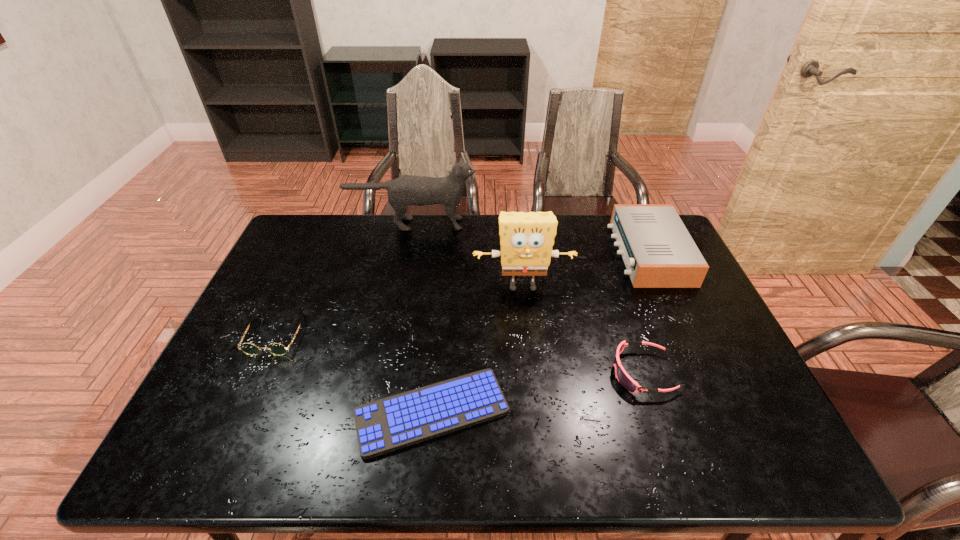
Locate an element on the screen. vacant space situated 0.370m on the control panel of the radio receiver is located at coordinates (503, 253).

At what (x,y) coordinates should I click in order to perform the action: click on vacant region located on the front-facing side of the goggles. Please return your answer as a coordinate pair (x, y). Looking at the image, I should click on (572, 373).

Identify the location of free space located 0.330m on the front-facing side of the goggles. (480, 373).

Locate an element on the screen. This screenshot has width=960, height=540. free space located on the front-facing side of the goggles is located at coordinates pyautogui.click(x=484, y=373).

This screenshot has width=960, height=540. I want to click on vacant space situated on the lenses of the leftmost object, so click(229, 437).

You are a GUI agent. You are given a task and a screenshot of the screen. Output one action in this format:
    pyautogui.click(x=<x>, y=<y>)
    Task: Click on the vacant space located 0.210m on the right of the shortest object
    
    Given the screenshot: What is the action you would take?
    pyautogui.click(x=600, y=412)

This screenshot has height=540, width=960. Find the location of `cat present at the far edge`. cat present at the far edge is located at coordinates (406, 190).

What are the coordinates of `radio receiver that is at the far edge` in the screenshot? It's located at (658, 251).

Identify the location of object positioned at the near edge. (398, 421).

Locate an element on the screen. The width and height of the screenshot is (960, 540). object situated at the left edge is located at coordinates (278, 349).